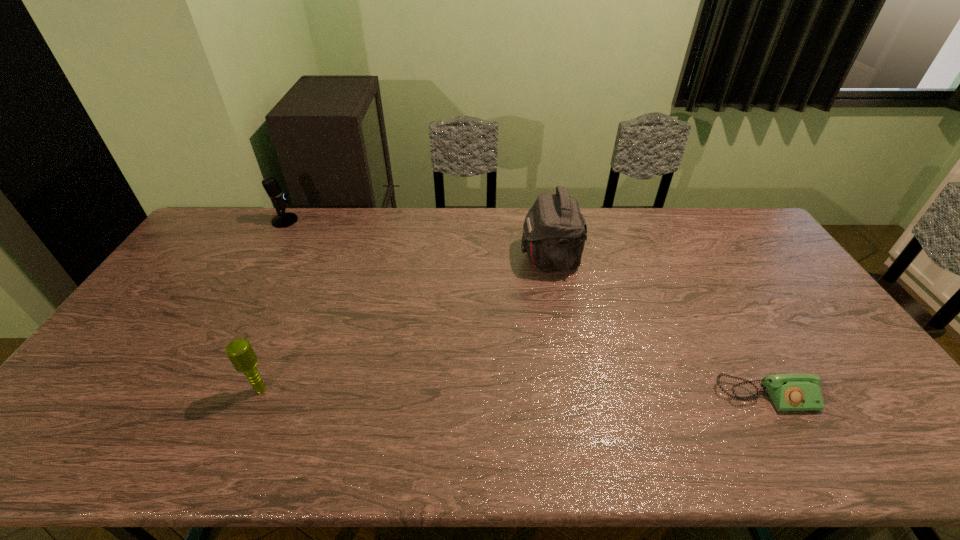
Identify which object is the third closest to the nearer microphone. Please provide its 2D coordinates. Your answer should be formatted as a tuple, i.e. [(x, y)], where the tuple contains the x and y coordinates of a point satisfying the conditions above.

[(789, 392)]

This screenshot has width=960, height=540. In order to click on vacant space that satisfies the following two spatial constraints: 1. on the front side of the right microphone; 2. on the left side of the farthest object in this screenshot , I will do `click(189, 389)`.